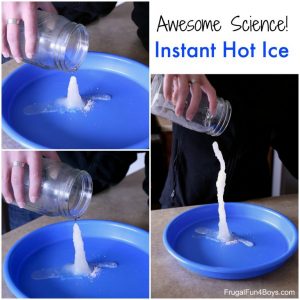
Identify the location of table. This screenshot has height=300, width=300. (154, 262), (130, 203), (115, 45).